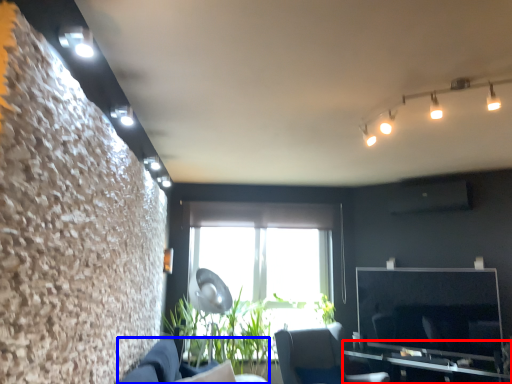
Question: Which of the following is the farthest to the observer, table (highlighted by a red box) or couch (highlighted by a blue box)?

Choices:
 (A) table
 (B) couch

Answer: (A)